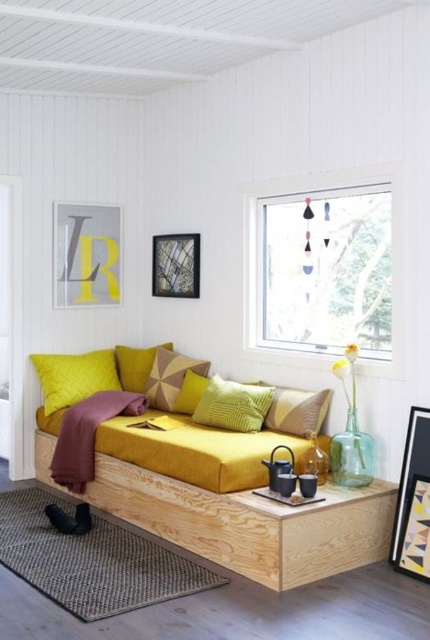
Question: Does wooden picture frame at lower right appear on the right side of velvet yellow pillow at center?

Choices:
 (A) yes
 (B) no

Answer: (A)

Question: Which object is positioned closest to the yellow paper at upper left?

Choices:
 (A) yellow textured pillow at center
 (B) textured beige pillow at center
 (C) velvet yellow pillow at center

Answer: (C)

Question: Is the position of textured beige pillow at center less distant than that of yellow textured pillow at center?

Choices:
 (A) yes
 (B) no

Answer: (A)

Question: Among these objects, which one is nearest to the camera?

Choices:
 (A) wooden picture frame at lower right
 (B) metallic reflective frame at upper center
 (C) yellow fabric pillow at center

Answer: (A)

Question: Among these objects, which one is farthest from the camera?

Choices:
 (A) yellow textured pillow at center
 (B) textured beige pillow at center
 (C) yellow paper at upper left

Answer: (C)

Question: Does velvet yellow pillow at center appear over metallic reflective frame at upper center?

Choices:
 (A) no
 (B) yes

Answer: (A)